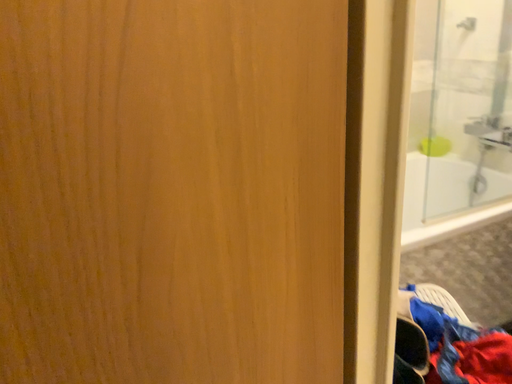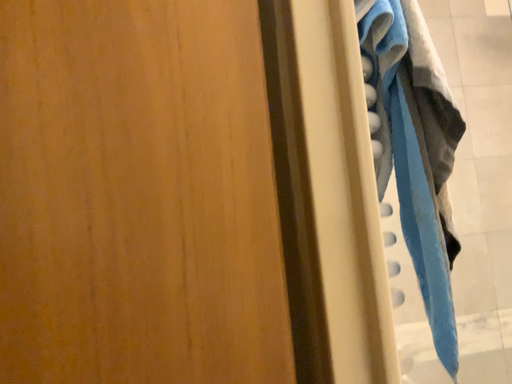
Question: How did the camera likely rotate when shooting the video?

Choices:
 (A) rotated upward
 (B) rotated downward

Answer: (A)